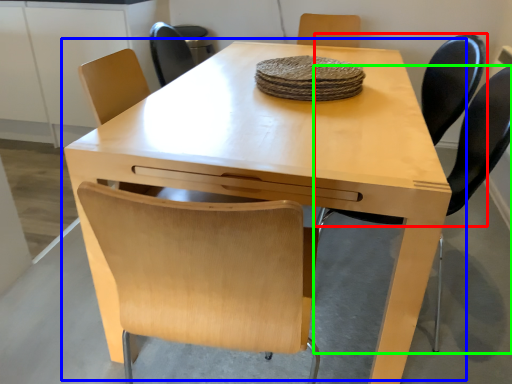
Question: Which is farther away from chair (highlighted by a red box)? table (highlighted by a blue box) or chair (highlighted by a green box)?

Choices:
 (A) table
 (B) chair

Answer: (A)